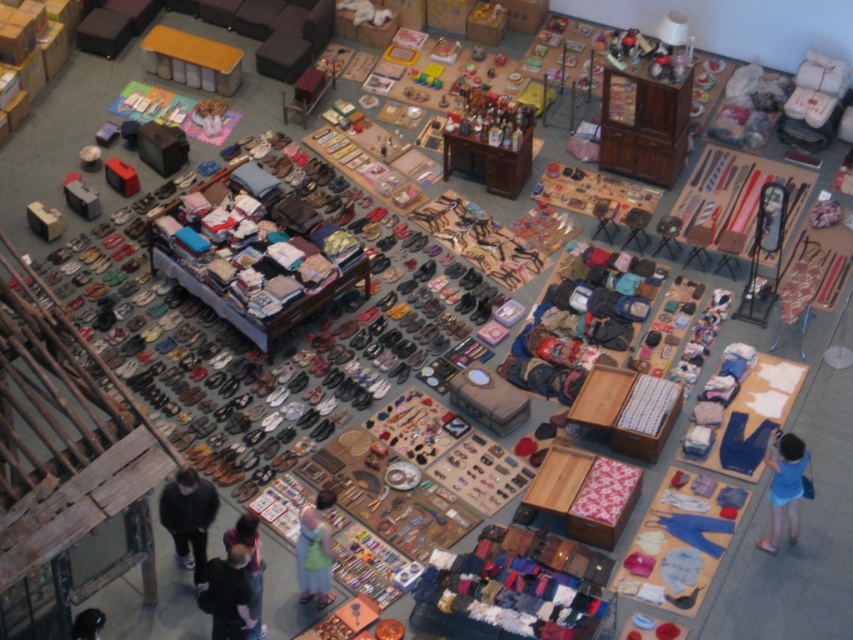
You are a customer at the flea market and want to pick up both the dark gray sweater at lower left and the light blue fabric dress at center. Which item should you reach for first to avoid disturbing the other item?

You should pick up the dark gray sweater at lower left first because it is located above the light blue fabric dress at center, so removing it won

You are a customer at the flea market and want to buy both the dark gray sweater at lower left and the light blue fabric dress at center. If you have a small bag that can only carry one item, which item should you choose based on size?

The dark gray sweater at lower left is bigger than the light blue fabric dress at center, so you should choose the light blue fabric dress at center because it is smaller and fits better in your small bag.